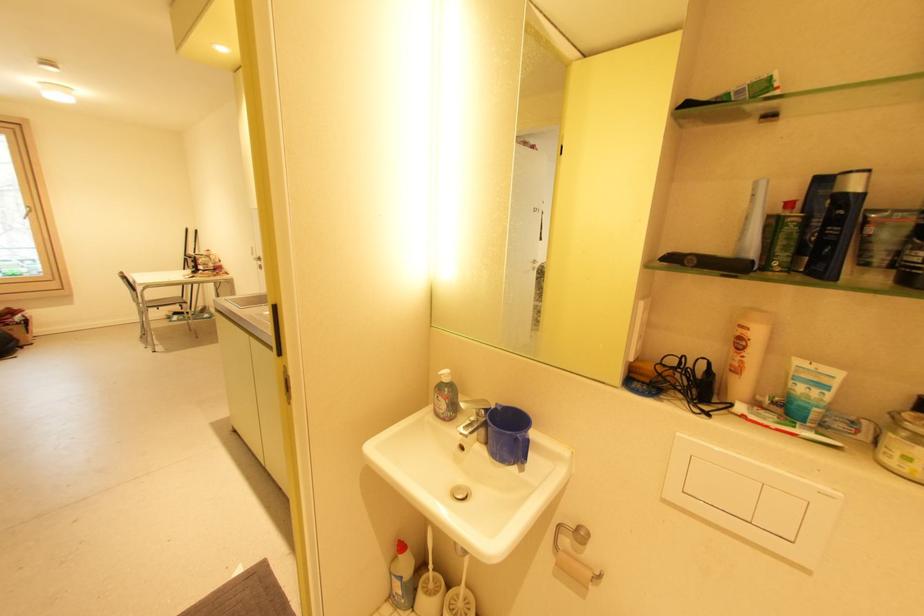
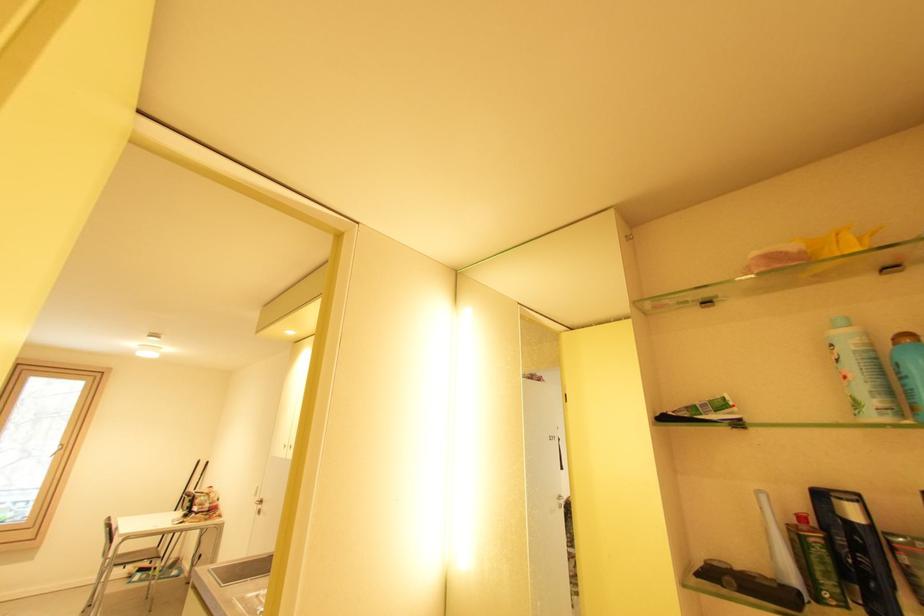
Question: How did the camera likely rotate?

Choices:
 (A) Left
 (B) Right
 (C) Up
 (D) Down

Answer: (C)